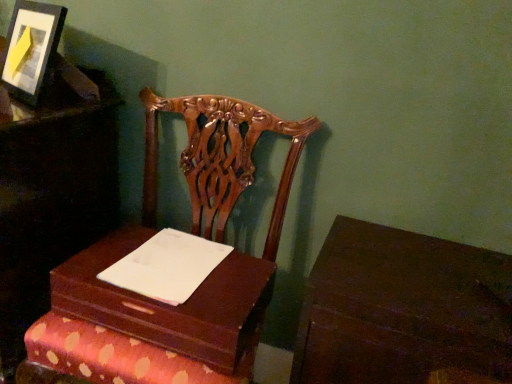
Question: Should I look upward or downward to see white paper at center?

Choices:
 (A) down
 (B) up

Answer: (A)

Question: Is wooden box at center behind white paper at center?

Choices:
 (A) yes
 (B) no

Answer: (B)

Question: Does wooden box at center appear on the left side of white paper at center?

Choices:
 (A) no
 (B) yes

Answer: (B)

Question: Is wooden box at center outside white paper at center?

Choices:
 (A) no
 (B) yes

Answer: (B)

Question: Is wooden box at center directly adjacent to white paper at center?

Choices:
 (A) no
 (B) yes

Answer: (B)

Question: Can you confirm if wooden box at center is shorter than white paper at center?

Choices:
 (A) yes
 (B) no

Answer: (B)

Question: Would you say wooden box at center is a long distance from white paper at center?

Choices:
 (A) no
 (B) yes

Answer: (A)

Question: Is mahogany wood chair at center, the 1th furniture positioned from the right, positioned behind white paper at center?

Choices:
 (A) no
 (B) yes

Answer: (A)

Question: Is mahogany wood chair at center, the 2th furniture viewed from the left, bigger than white paper at center?

Choices:
 (A) no
 (B) yes

Answer: (B)

Question: From the image's perspective, is mahogany wood chair at center, the 1th furniture positioned from the right, under white paper at center?

Choices:
 (A) no
 (B) yes

Answer: (B)

Question: Would you say mahogany wood chair at center, the 1th furniture positioned from the right, contains white paper at center?

Choices:
 (A) yes
 (B) no

Answer: (A)

Question: From a real-world perspective, is mahogany wood chair at center, the 1th furniture positioned from the right, beneath white paper at center?

Choices:
 (A) yes
 (B) no

Answer: (A)

Question: Considering the relative sizes of mahogany wood chair at center, the 1th furniture positioned from the right, and white paper at center in the image provided, is mahogany wood chair at center, the 1th furniture positioned from the right, wider than white paper at center?

Choices:
 (A) no
 (B) yes

Answer: (B)

Question: Can we say wooden chair at left, marked as the 2th furniture in a right-to-left arrangement, lies outside wooden box at center?

Choices:
 (A) yes
 (B) no

Answer: (A)